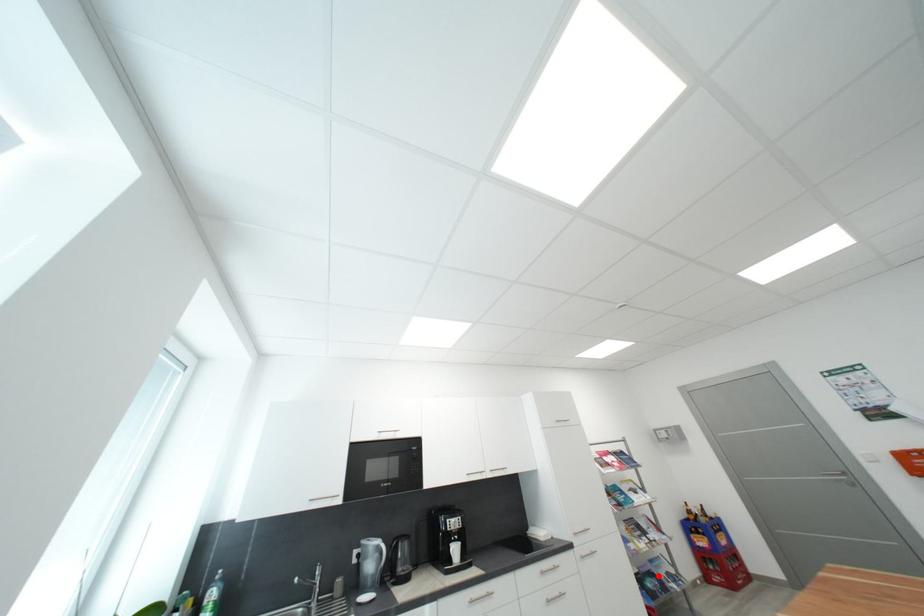
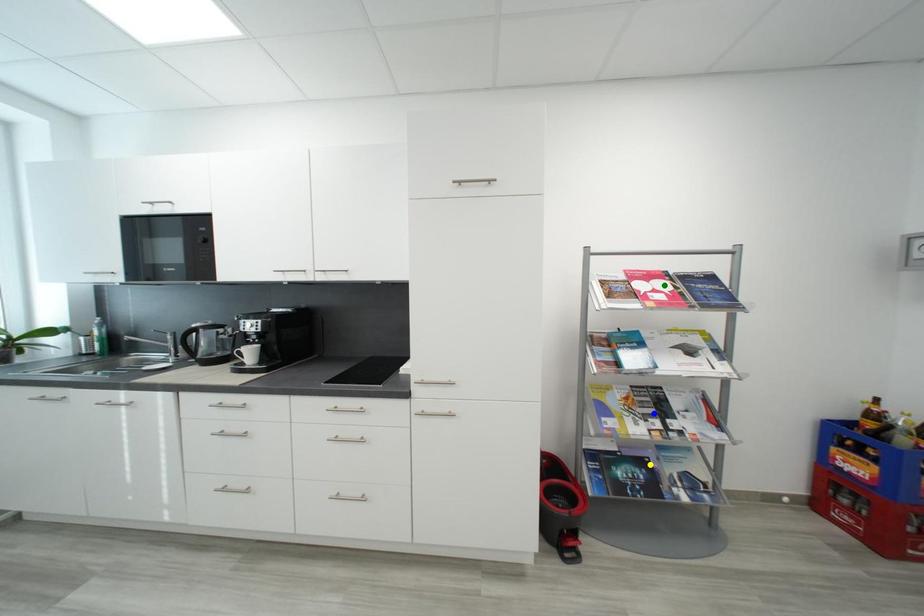
Question: I am providing you with two images of the same scene from different viewpoints. A red point is marked on the first image. You are given multiple points on the second image. Can you choose the point in image 2 that corresponds to the point in image 1?

Choices:
 (A) blue point
 (B) yellow point
 (C) green point

Answer: (B)